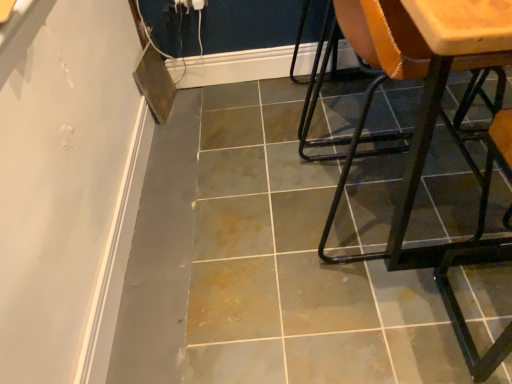
Question: Considering the positions of gray tile floor at center and matte orange chair at right, positioned as the third chair in right-to-left order, in the image, is gray tile floor at center taller or shorter than matte orange chair at right, positioned as the third chair in right-to-left order,?

Choices:
 (A) tall
 (B) short

Answer: (B)

Question: Relative to matte orange chair at right, positioned as the third chair in right-to-left order, is gray tile floor at center in front or behind?

Choices:
 (A) behind
 (B) front

Answer: (B)

Question: Based on their relative distances, which object is nearer to the gray tile floor at center?

Choices:
 (A) matte orange chair at right, positioned as the third chair in right-to-left order
 (B) metallic orange chair at right, which ranks as the 2th chair in right-to-left order
 (C) wooden seat at right, acting as the 3th chair starting from the left

Answer: (C)

Question: Which is nearer to the metallic orange chair at right, which ranks as the 2th chair in right-to-left order?

Choices:
 (A) matte orange chair at right, the first chair in the left-to-right sequence
 (B) wooden seat at right, arranged as the 1th chair when viewed from the right
 (C) gray tile floor at center

Answer: (B)